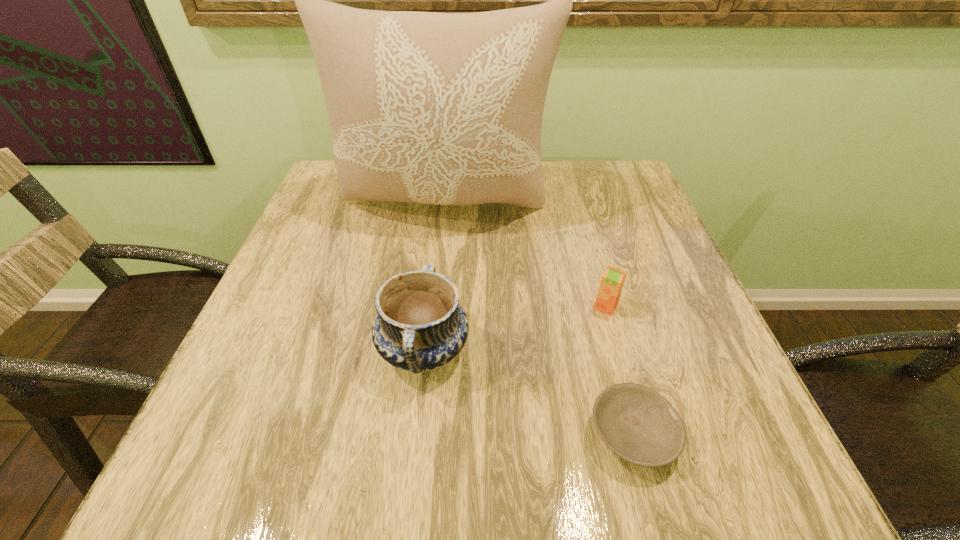
The image size is (960, 540). I want to click on object that stands as the second closest to the bowl, so click(x=420, y=326).

The width and height of the screenshot is (960, 540). Find the location of `object that is the closest to the orange juice`. object that is the closest to the orange juice is located at coordinates (635, 422).

This screenshot has width=960, height=540. Find the location of `vacant space that satisfies the following two spatial constraints: 1. on the front side of the orange juice; 2. on the right side of the farthest object`. vacant space that satisfies the following two spatial constraints: 1. on the front side of the orange juice; 2. on the right side of the farthest object is located at coordinates coord(435,307).

In order to click on vacant area in the image that satisfies the following two spatial constraints: 1. on the back side of the orange juice; 2. on the left side of the pottery in this screenshot , I will do `click(428, 307)`.

Image resolution: width=960 pixels, height=540 pixels. I want to click on free space that satisfies the following two spatial constraints: 1. on the front side of the tallest object; 2. on the left side of the third tallest object, so click(435, 307).

At what (x,y) coordinates should I click in order to perform the action: click on vacant space that satisfies the following two spatial constraints: 1. on the front side of the cushion; 2. on the left side of the shortest object. Please return your answer as a coordinate pair (x, y). Looking at the image, I should click on (x=422, y=435).

Locate an element on the screen. vacant space that satisfies the following two spatial constraints: 1. on the front side of the bowl; 2. on the left side of the pottery is located at coordinates (414, 435).

Image resolution: width=960 pixels, height=540 pixels. In order to click on vacant space that satisfies the following two spatial constraints: 1. on the front side of the cushion; 2. on the right side of the bowl in this screenshot , I will do `click(422, 435)`.